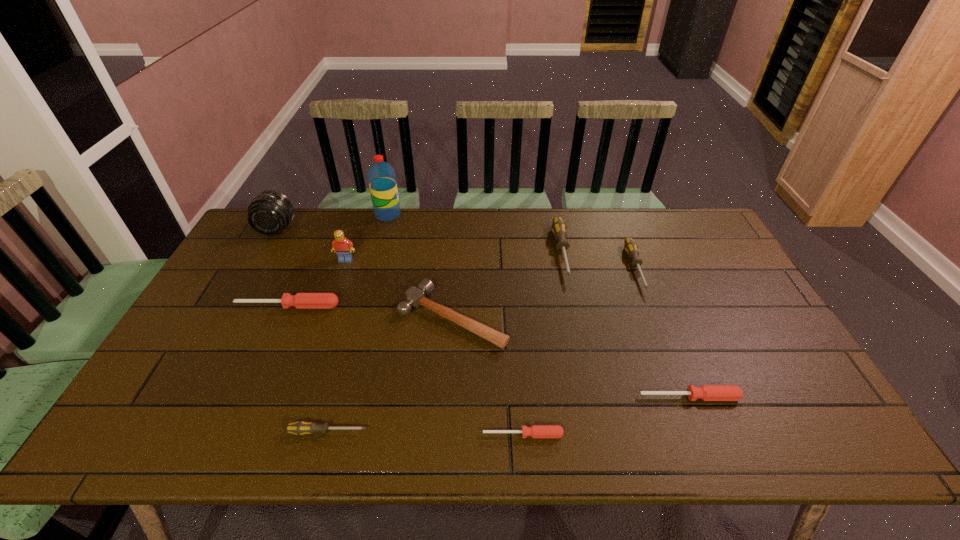
Find the location of a particular element. The height and width of the screenshot is (540, 960). water bottle is located at coordinates coord(381,176).

The image size is (960, 540). What are the coordinates of `the tallest object` in the screenshot? It's located at (381, 176).

Find the location of a particular element. the second tallest object is located at coordinates (269, 213).

Where is `the third tallest object`? The height and width of the screenshot is (540, 960). the third tallest object is located at coordinates (343, 247).

What are the coordinates of `the biggest gray screwdriver` in the screenshot? It's located at (558, 228).

You are a GUI agent. You are given a task and a screenshot of the screen. Output one action in this format:
    pyautogui.click(x=<x>, y=<y>)
    Task: Click on the second gray screwdriver from right to left
    The width and height of the screenshot is (960, 540).
    Given the screenshot: What is the action you would take?
    pyautogui.click(x=558, y=228)

Where is `hammer`? The image size is (960, 540). hammer is located at coordinates (415, 296).

Where is `the second smallest gray screwdriver`? The image size is (960, 540). the second smallest gray screwdriver is located at coordinates (630, 246).

The width and height of the screenshot is (960, 540). Find the location of `the third farthest screwdriver`. the third farthest screwdriver is located at coordinates coord(301,300).

This screenshot has width=960, height=540. In order to click on the farthest red screwdriver in this screenshot , I will do `click(301, 300)`.